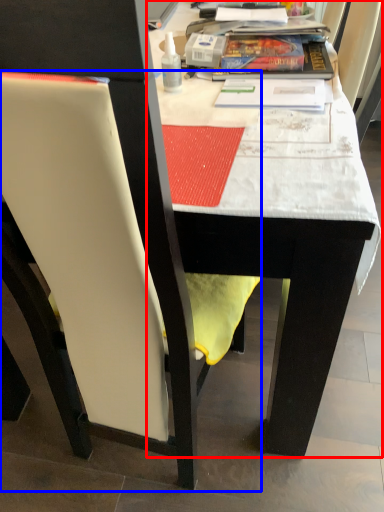
Question: Which point is closer to the camera, table (highlighted by a red box) or chair (highlighted by a blue box)?

Choices:
 (A) table
 (B) chair

Answer: (B)